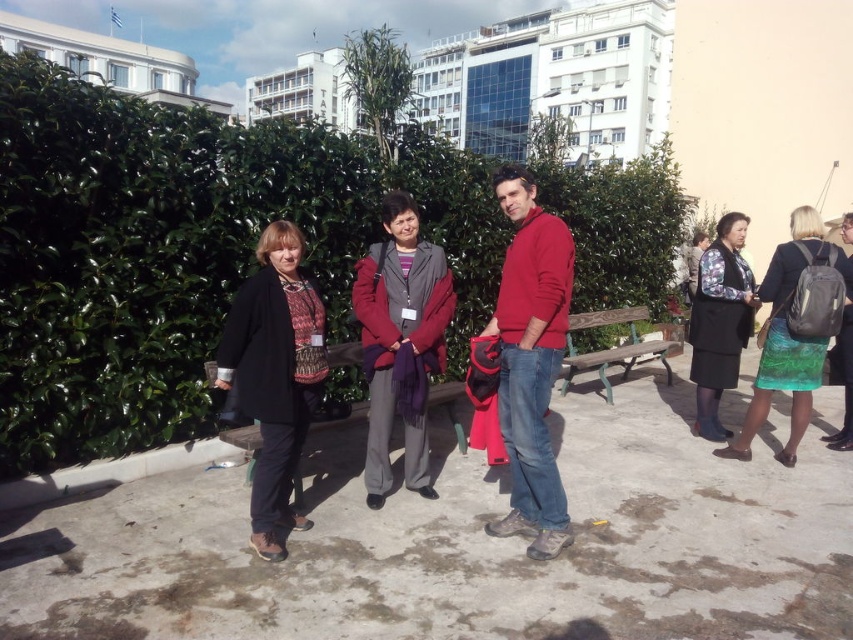
Between point (718, 301) and point (605, 355), which one is positioned in front?

Positioned in front is point (718, 301).

In the scene shown: Which is more to the right, dark gray woolen skirt at right or wooden park bench at center?

wooden park bench at center is more to the right.

Image resolution: width=853 pixels, height=640 pixels. What do you see at coordinates (718, 323) in the screenshot? I see `dark gray woolen skirt at right` at bounding box center [718, 323].

The width and height of the screenshot is (853, 640). What are the coordinates of `dark gray woolen skirt at right` in the screenshot? It's located at (718, 323).

Is purple scarf at center taller than green textured skirt at right?

No, purple scarf at center is not taller than green textured skirt at right.

Between purple scarf at center and green textured skirt at right, which one is positioned lower?

Positioned lower is purple scarf at center.

Between point (376, 262) and point (776, 266), which one is positioned in front?

Positioned in front is point (376, 262).

Locate an element on the screen. purple scarf at center is located at coordinates (399, 340).

Which is more to the left, green leafy hedge at upper left or dark gray woolen skirt at right?

Positioned to the left is green leafy hedge at upper left.

Does green leafy hedge at upper left have a smaller size compared to dark gray woolen skirt at right?

Correct, green leafy hedge at upper left occupies less space than dark gray woolen skirt at right.

Who is more distant from viewer, (137, 403) or (695, 312)?

Positioned behind is point (695, 312).

This screenshot has width=853, height=640. Identify the location of green leafy hedge at upper left. 144,256.